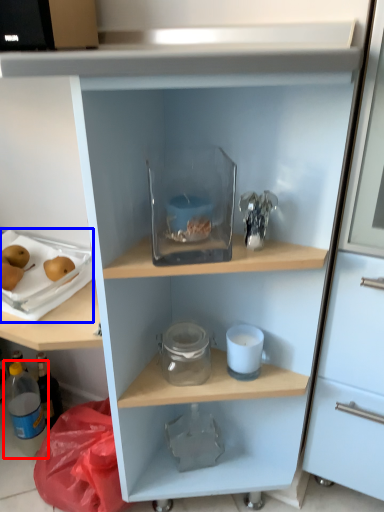
Question: Which object is closer to the camera taking this photo, bottle (highlighted by a red box) or appliance (highlighted by a blue box)?

Choices:
 (A) bottle
 (B) appliance

Answer: (B)